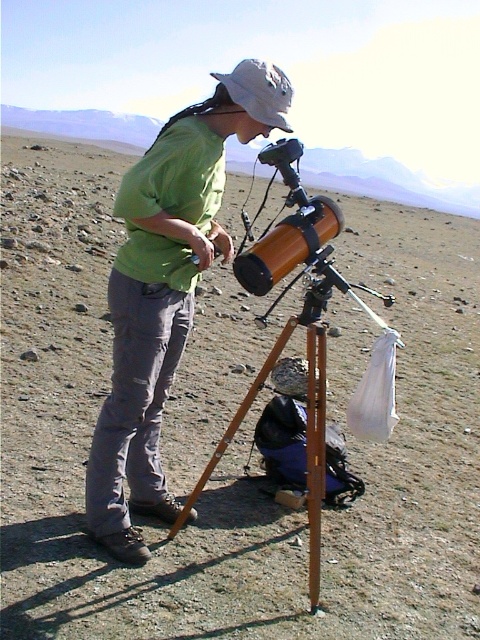
You are an astronomer planning to adjust the telescope setup. You need to place a protective cover over the green matte shirt at center and the wooden tripod at center. Which object requires a larger cover in terms of height?

The green matte shirt at center requires a larger cover because it is much taller than the wooden tripod at center.

You are an astronaut preparing for a spacewalk and need to ensure all equipment is properly secured. Looking at the image, which object is positioned higher relative to the other between the green matte shirt at center and the white fabric baseball hat at upper center?

The white fabric baseball hat at upper center is positioned higher than the green matte shirt at center.